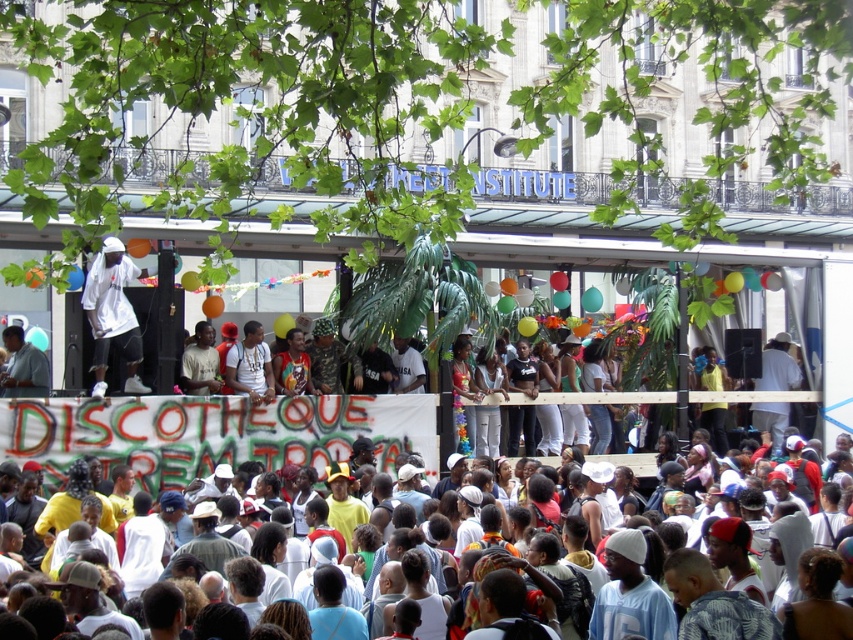
Question: Among these objects, which one is farthest from the camera?

Choices:
 (A) white matte shirt at center
 (B) white cotton crowd at center

Answer: (A)

Question: Estimate the real-world distances between objects in this image. Which object is closer to the white matte shirt at center?

Choices:
 (A) light blue shirt at lower left
 (B) white cotton crowd at center
 (C) white matte clothing at center

Answer: (B)

Question: Where is white matte shirt at center located in relation to light blue shirt at lower left in the image?

Choices:
 (A) left
 (B) right

Answer: (B)

Question: Does white cotton crowd at center appear on the right side of white matte shirt at center?

Choices:
 (A) no
 (B) yes

Answer: (B)

Question: Considering the real-world distances, which object is closest to the white cotton crowd at center?

Choices:
 (A) light blue shirt at lower left
 (B) white matte clothing at center
 (C) white matte shirt at center

Answer: (A)

Question: Can you confirm if white matte shirt at center is positioned below light blue shirt at lower left?

Choices:
 (A) yes
 (B) no

Answer: (B)